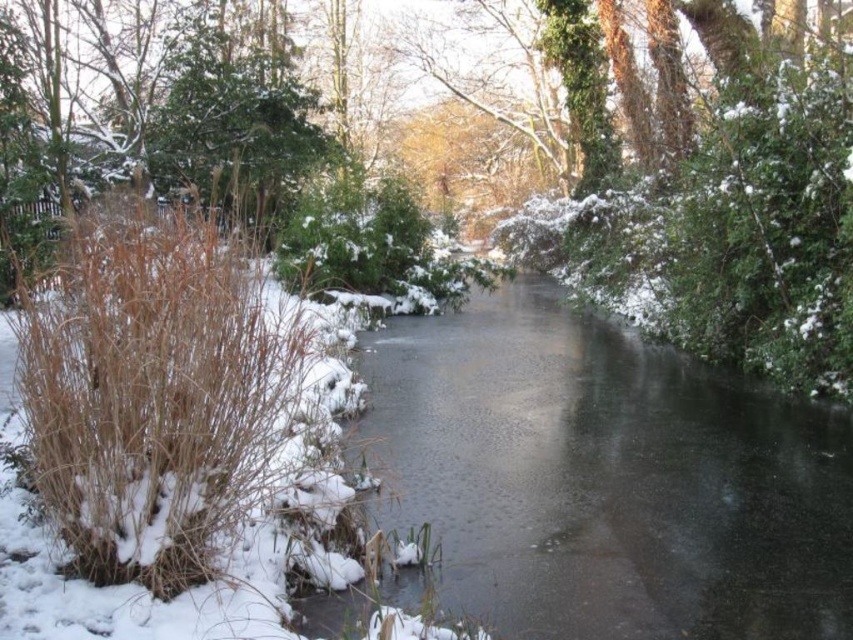
Can you confirm if frozen ice at center is positioned to the right of brown dry reed at left?

Correct, you'll find frozen ice at center to the right of brown dry reed at left.

Does frozen ice at center have a lesser height compared to brown dry reed at left?

Indeed, frozen ice at center has a lesser height compared to brown dry reed at left.

Is point (640, 529) behind point (120, 545)?

Yes.

Locate an element on the screen. This screenshot has width=853, height=640. frozen ice at center is located at coordinates (602, 477).